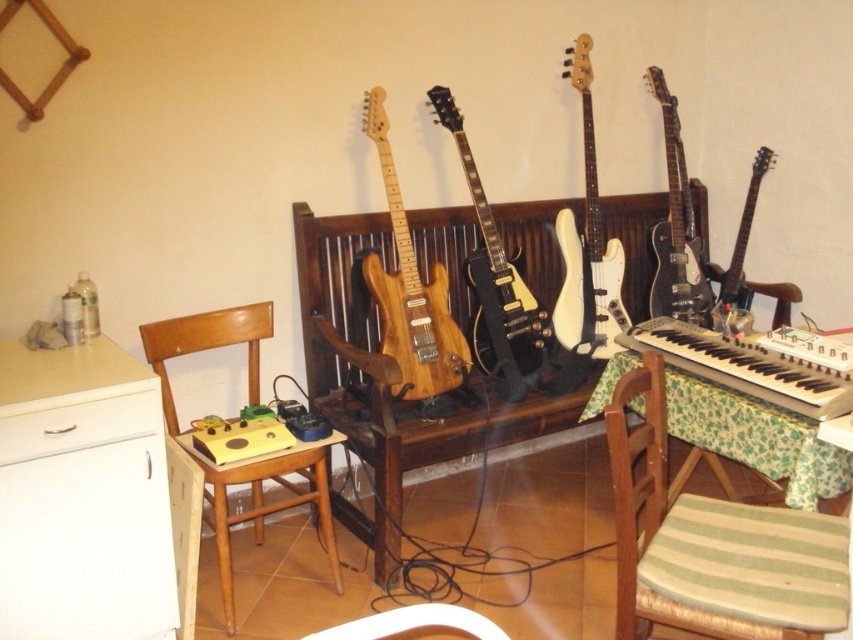
You are standing in the music room and want to move from the wooden chair at left to the glossy black electric guitar at upper right. Which object is closer to your starting position?

The wooden chair at left is closer to the viewer than the glossy black electric guitar at upper right, so the wooden chair at left is closer to your starting position.

Please provide the coordinates of the white matte bass guitar at center in the image. The coordinate system is defined with the origin at the bottom left corner of the image, where the x and y axes increase to the right and upward respectively. The maximum x and y values are both 1.0.

The white matte bass guitar at center is located at coordinates approximately 0.384 in the x direction and 0.689 in the y direction.

You are a delivery person who needs to place a package between the white plastic keyboard at right and the white plastic chair at lower center. The package is 3 feet long. Can you fit it in the space between them?

The distance between the white plastic keyboard at right and the white plastic chair at lower center is 3.83 feet, so the 3 feet long package can fit in the space between them.